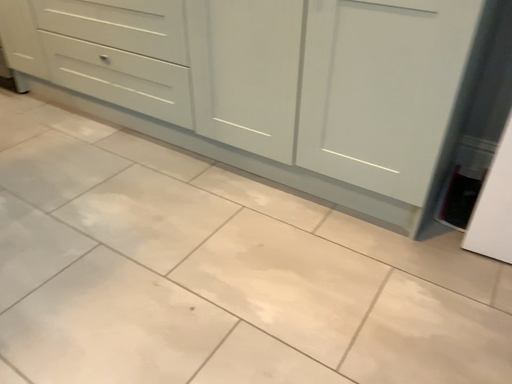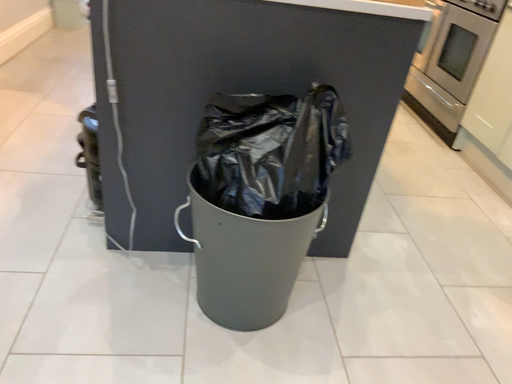
Question: How did the camera likely rotate when shooting the video?

Choices:
 (A) rotated upward
 (B) rotated downward

Answer: (A)